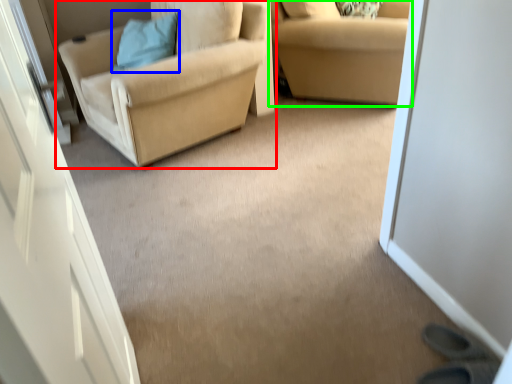
Question: Which is nearer to the chair (highlighted by a red box)? pillow (highlighted by a blue box) or studio couch (highlighted by a green box).

Choices:
 (A) pillow
 (B) studio couch

Answer: (A)